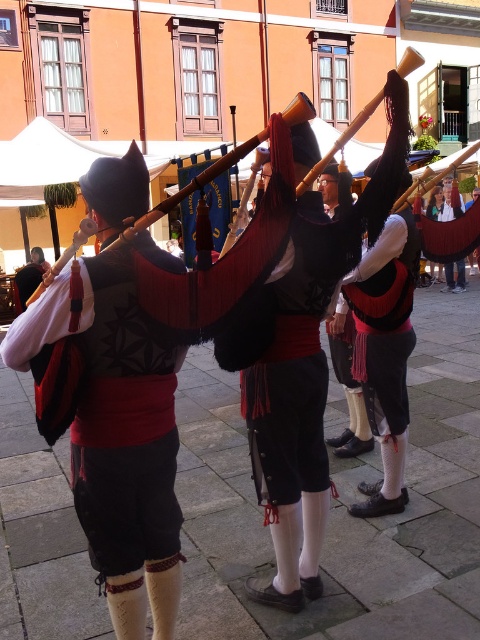
The height and width of the screenshot is (640, 480). Describe the element at coordinates (384, 364) in the screenshot. I see `matte black vest at center` at that location.

Is point (384, 257) behind point (142, 225)?

Yes, point (384, 257) is behind point (142, 225).

This screenshot has width=480, height=640. In order to click on matte black vest at center in this screenshot , I will do `click(384, 364)`.